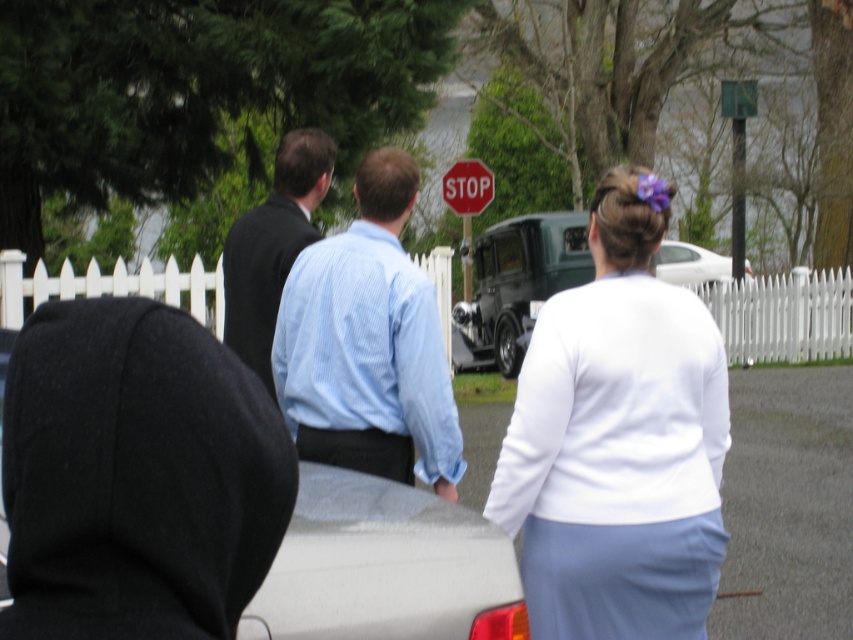
From the picture: Can you confirm if black fleece hoodie at center is thinner than red plastic stop sign at center?

Indeed, black fleece hoodie at center has a lesser width compared to red plastic stop sign at center.

Is point (71, 323) positioned in front of point (462, 161)?

Yes.

Image resolution: width=853 pixels, height=640 pixels. What do you see at coordinates (136, 476) in the screenshot? I see `black fleece hoodie at center` at bounding box center [136, 476].

I want to click on black fleece hoodie at center, so click(x=136, y=476).

Does point (621, 550) lie in front of point (267, 248)?

Yes, it is.

Who is higher up, white matte shirt at center or dark suit at center?

Positioned higher is dark suit at center.

Does point (695, 394) come behind point (283, 257)?

No, it is not.

Find the location of `white matte shirt at center`. white matte shirt at center is located at coordinates (618, 440).

Who is taller, black fleece hoodie at center or dark suit at center?

Standing taller between the two is dark suit at center.

Which is in front, point (171, 564) or point (315, 204)?

Point (171, 564) is more forward.

Is point (213, 493) positioned behind point (270, 273)?

No, (213, 493) is in front of (270, 273).

Find the location of `black fleece hoodie at center`. black fleece hoodie at center is located at coordinates (136, 476).